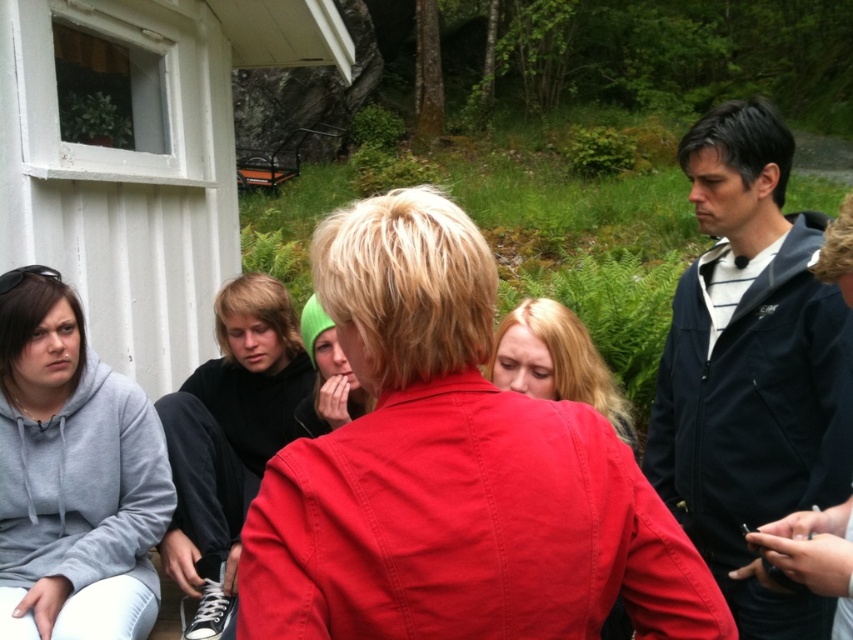
You are a photographer trying to capture a photo of the matte red jacket at center and the green knit hat at center. Which object should you focus on first to ensure both are in sharp focus?

The matte red jacket at center is closer to the viewer than the green knit hat at center. To ensure both are in sharp focus, focus on the matte red jacket at center first, as it is closer.